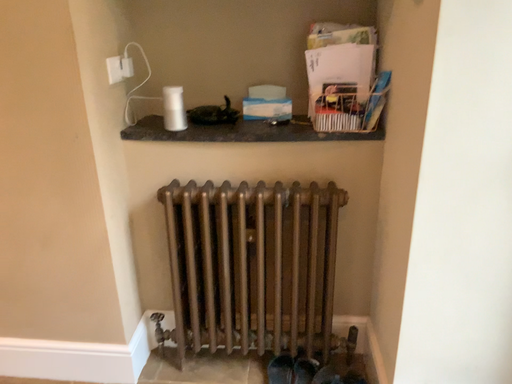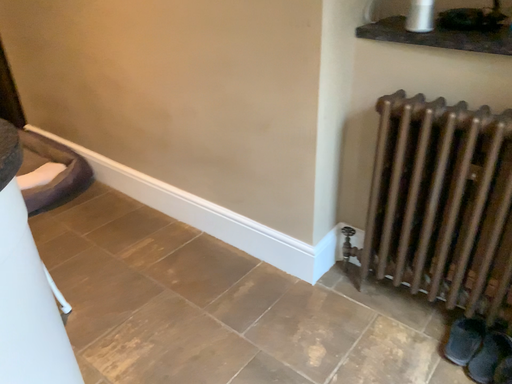
Question: Which way did the camera rotate in the video?

Choices:
 (A) rotated left
 (B) rotated right

Answer: (A)